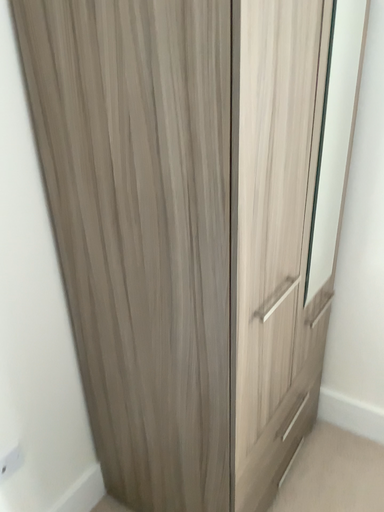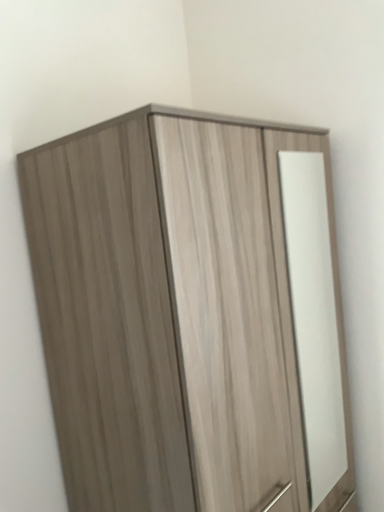
Question: How did the camera likely rotate when shooting the video?

Choices:
 (A) rotated upward
 (B) rotated downward

Answer: (A)